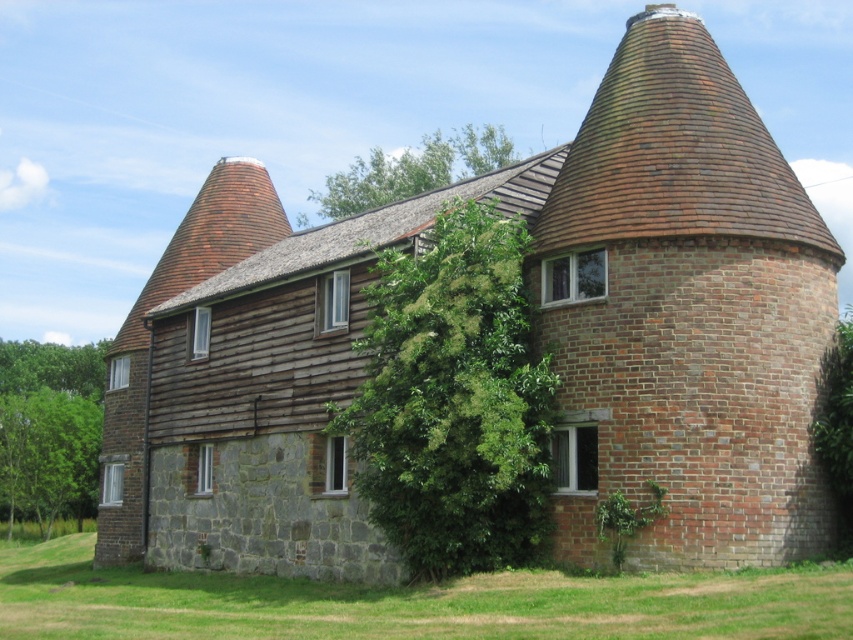
Can you confirm if wooden shingles chimney at center is taller than green leafy tree at lower left?

Yes, wooden shingles chimney at center is taller than green leafy tree at lower left.

Does point (132, 333) lie behind point (64, 365)?

No, (132, 333) is closer to viewer.

Does point (111, 456) lie behind point (15, 467)?

No, (111, 456) is closer to viewer.

The height and width of the screenshot is (640, 853). In order to click on wooden shingles chimney at center in this screenshot , I will do `click(154, 342)`.

Which of these two, red brick chimney at center or green leafy tree at lower left, stands taller?

With more height is red brick chimney at center.

Between red brick chimney at center and green leafy tree at lower left, which one appears on the right side from the viewer's perspective?

Positioned to the right is red brick chimney at center.

Which is behind, point (692, 289) or point (68, 364)?

The point (68, 364) is more distant.

The image size is (853, 640). In order to click on red brick chimney at center in this screenshot , I will do `click(683, 312)`.

Is wooden shingles chimney at center wider than green leafy tree at upper center?

Indeed, wooden shingles chimney at center has a greater width compared to green leafy tree at upper center.

Between point (158, 298) and point (332, 193), which one is positioned in front?

Point (158, 298)

Locate an element on the screen. wooden shingles chimney at center is located at coordinates (154, 342).